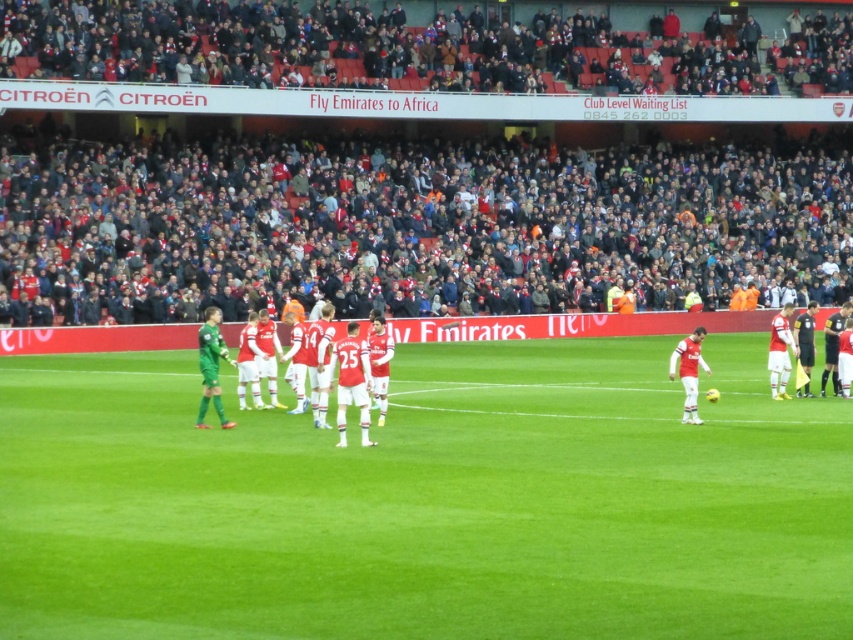
Is white jersey players at center thinner than matte white jersey at right?

No, white jersey players at center is not thinner than matte white jersey at right.

Where is `white jersey players at center`? Image resolution: width=853 pixels, height=640 pixels. white jersey players at center is located at coordinates (225, 358).

This screenshot has height=640, width=853. In order to click on white jersey players at center in this screenshot , I will do `click(225, 358)`.

Between dark gray crowd at upper center and white jersey players at center, which one has more height?

With more height is dark gray crowd at upper center.

What are the coordinates of `dark gray crowd at upper center` in the screenshot? It's located at (409, 221).

Which is in front, point (242, 179) or point (247, 355)?

Point (247, 355)

Locate an element on the screen. The image size is (853, 640). dark gray crowd at upper center is located at coordinates (409, 221).

Who is taller, dark gray crowd at upper center or green grass field at center?

dark gray crowd at upper center is taller.

At what (x,y) coordinates should I click in order to perform the action: click on dark gray crowd at upper center. Please return your answer as a coordinate pair (x, y). This screenshot has width=853, height=640. Looking at the image, I should click on (409, 221).

Locate an element on the screen. This screenshot has width=853, height=640. dark gray crowd at upper center is located at coordinates (409, 221).